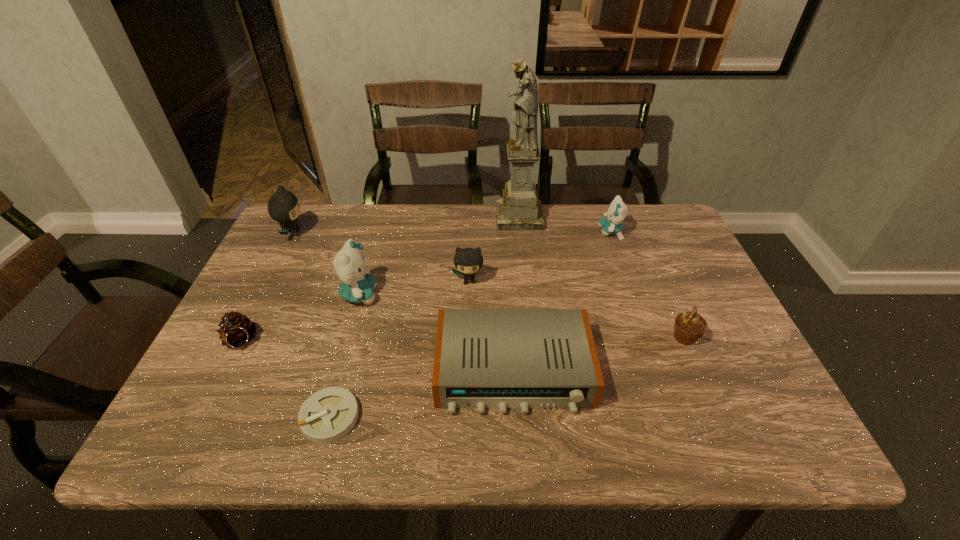
Identify the location of the rightmost object. The width and height of the screenshot is (960, 540). (689, 326).

Find the location of a particular element. Image resolution: width=960 pixels, height=540 pixels. pinecone is located at coordinates (236, 330).

At what (x,y) coordinates should I click in order to perform the action: click on radio receiver. Please return your answer as a coordinate pair (x, y). This screenshot has width=960, height=540. Looking at the image, I should click on (502, 359).

The height and width of the screenshot is (540, 960). What are the coordinates of `gray ashtray` in the screenshot? It's located at (328, 415).

Where is `the shortest object`? the shortest object is located at coordinates (328, 415).

I want to click on free spot located 0.110m on the front-facing side of the tallest object, so click(462, 217).

Where is `vacant space situated on the front-facing side of the tallest object`? This screenshot has height=540, width=960. vacant space situated on the front-facing side of the tallest object is located at coordinates (456, 217).

Find the location of a particular element. The image size is (960, 540). free space located on the front-facing side of the tallest object is located at coordinates (452, 217).

Locate an element on the screen. The width and height of the screenshot is (960, 540). free space located 0.280m on the face of the third kitten from right to left is located at coordinates (485, 294).

I want to click on free space located 0.050m on the front-facing side of the farther gray kitten, so click(323, 233).